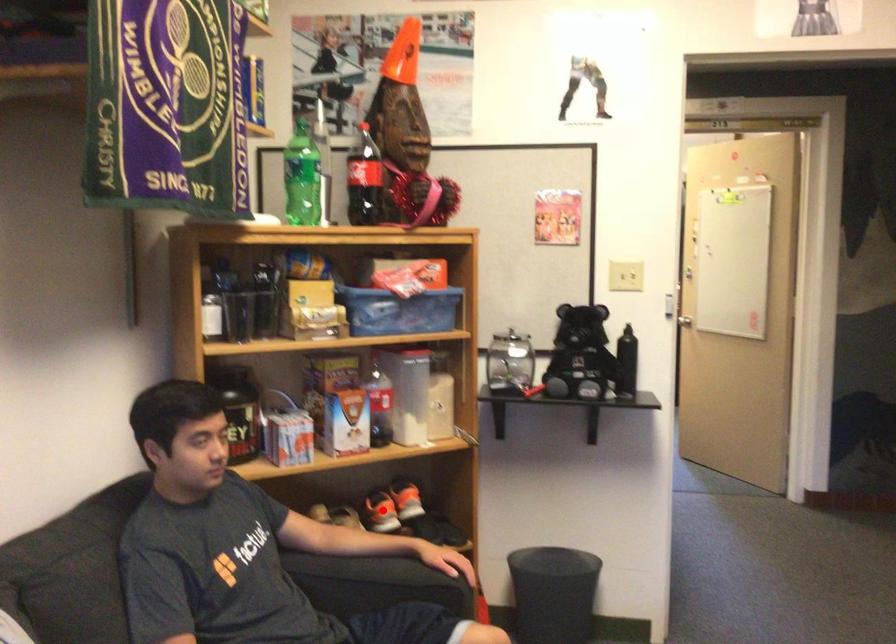
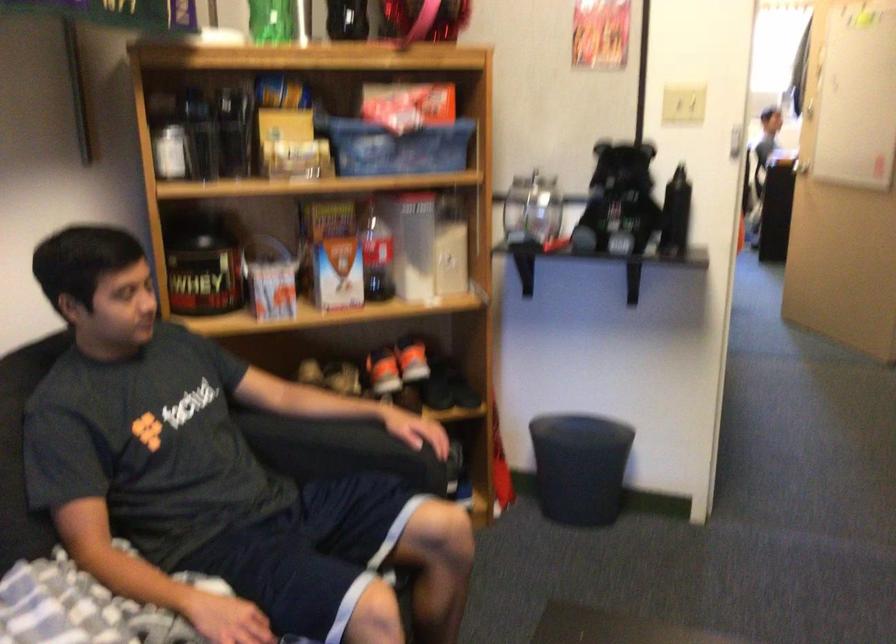
In the second image, find the point that corresponds to the highlighted location in the first image.

(383, 371)